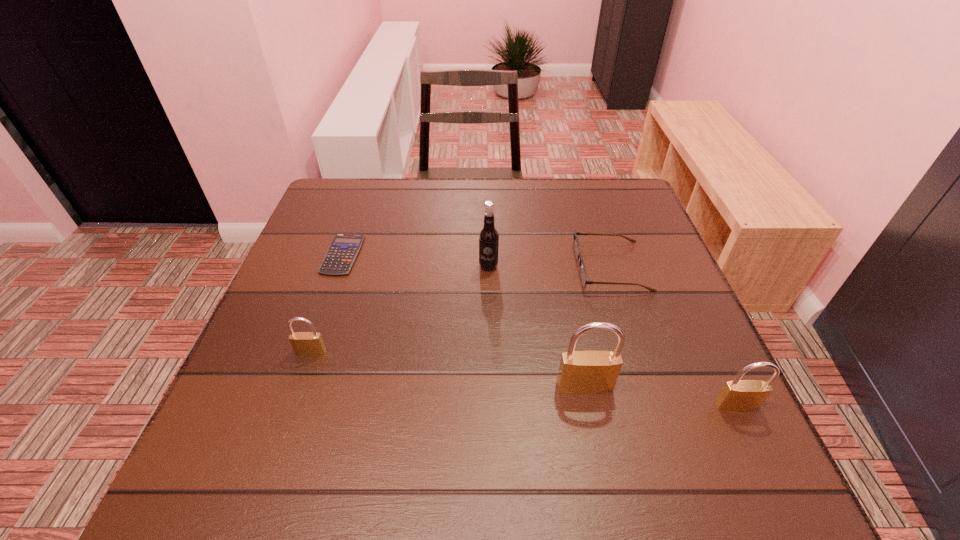
If equal spacing is desired by inserting an extra padlock among them, please point out a free spot for this new padlock. Please provide its 2D coordinates. Your answer should be formatted as a tuple, i.e. [(x, y)], where the tuple contains the x and y coordinates of a point satisfying the conditions above.

[(444, 368)]